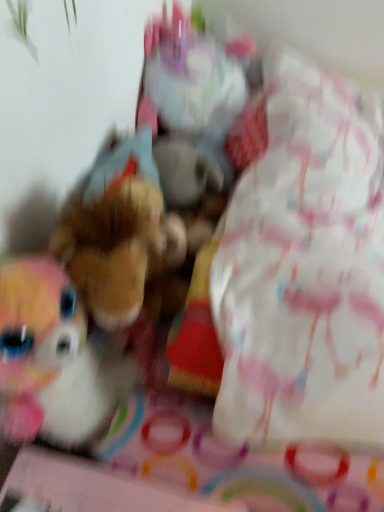
Question: Are fluffy plush unicorn at upper center, placed as the second toy when sorted from bottom to top, and brown plush toy at center, which is the 1th toy in bottom-to-top order, beside each other?

Choices:
 (A) yes
 (B) no

Answer: (B)

Question: Is fluffy plush unicorn at upper center, placed as the second toy when sorted from bottom to top, shorter than brown plush toy at center, which is the 1th toy in bottom-to-top order?

Choices:
 (A) yes
 (B) no

Answer: (B)

Question: Is fluffy plush unicorn at upper center, which is counted as the first toy, starting from the top, positioned before brown plush toy at center, which is the 1th toy in bottom-to-top order?

Choices:
 (A) yes
 (B) no

Answer: (B)

Question: Does fluffy plush unicorn at upper center, which is counted as the first toy, starting from the top, have a greater height compared to brown plush toy at center, which is the 1th toy in bottom-to-top order?

Choices:
 (A) no
 (B) yes

Answer: (B)

Question: Can you confirm if fluffy plush unicorn at upper center, which is counted as the first toy, starting from the top, is positioned to the left of brown plush toy at center, which is the 1th toy in bottom-to-top order?

Choices:
 (A) yes
 (B) no

Answer: (B)

Question: From a real-world perspective, is fluffy plush unicorn at upper center, which is counted as the first toy, starting from the top, on brown plush toy at center, acting as the 2th toy starting from the top?

Choices:
 (A) no
 (B) yes

Answer: (B)

Question: Is brown plush toy at center, which is the 1th toy in bottom-to-top order, looking in the opposite direction of fluffy plush unicorn at upper center, which is counted as the first toy, starting from the top?

Choices:
 (A) no
 (B) yes

Answer: (A)

Question: Considering the relative sizes of brown plush toy at center, acting as the 2th toy starting from the top, and fluffy plush unicorn at upper center, placed as the second toy when sorted from bottom to top, in the image provided, is brown plush toy at center, acting as the 2th toy starting from the top, taller than fluffy plush unicorn at upper center, placed as the second toy when sorted from bottom to top,?

Choices:
 (A) yes
 (B) no

Answer: (B)

Question: Is brown plush toy at center, acting as the 2th toy starting from the top, closer to camera compared to fluffy plush unicorn at upper center, placed as the second toy when sorted from bottom to top?

Choices:
 (A) no
 (B) yes

Answer: (B)

Question: Is brown plush toy at center, which is the 1th toy in bottom-to-top order, not close to fluffy plush unicorn at upper center, placed as the second toy when sorted from bottom to top?

Choices:
 (A) no
 (B) yes

Answer: (A)

Question: Is brown plush toy at center, which is the 1th toy in bottom-to-top order, located outside fluffy plush unicorn at upper center, placed as the second toy when sorted from bottom to top?

Choices:
 (A) yes
 (B) no

Answer: (A)

Question: Is brown plush toy at center, acting as the 2th toy starting from the top, oriented towards fluffy plush unicorn at upper center, placed as the second toy when sorted from bottom to top?

Choices:
 (A) yes
 (B) no

Answer: (B)

Question: Is fluffy plush unicorn at upper center, which is counted as the first toy, starting from the top, taller or shorter than brown plush toy at center, acting as the 2th toy starting from the top?

Choices:
 (A) tall
 (B) short

Answer: (A)